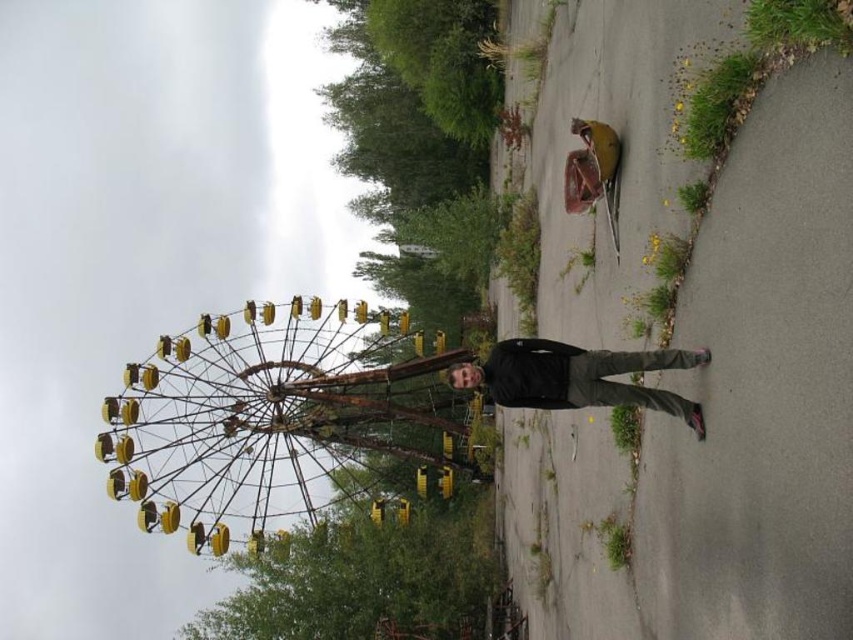
Can you confirm if rusty yellow ferris wheel at left is bigger than black matte jacket at center?

Correct, rusty yellow ferris wheel at left is larger in size than black matte jacket at center.

Is point (422, 404) less distant than point (521, 406)?

No.

This screenshot has width=853, height=640. In order to click on rusty yellow ferris wheel at left in this screenshot , I will do `click(282, 422)`.